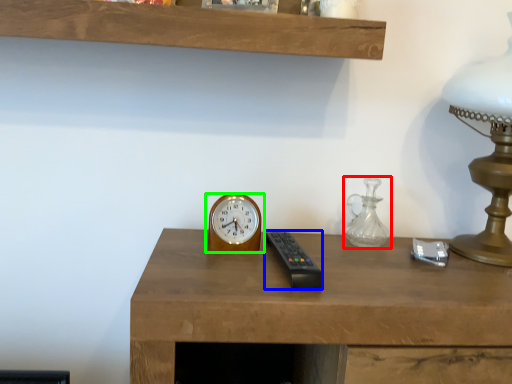
Question: Which object is the closest to the glass vase (highlighted by a red box)? Choose among these: control (highlighted by a blue box) or wall clock (highlighted by a green box).

Choices:
 (A) control
 (B) wall clock

Answer: (A)